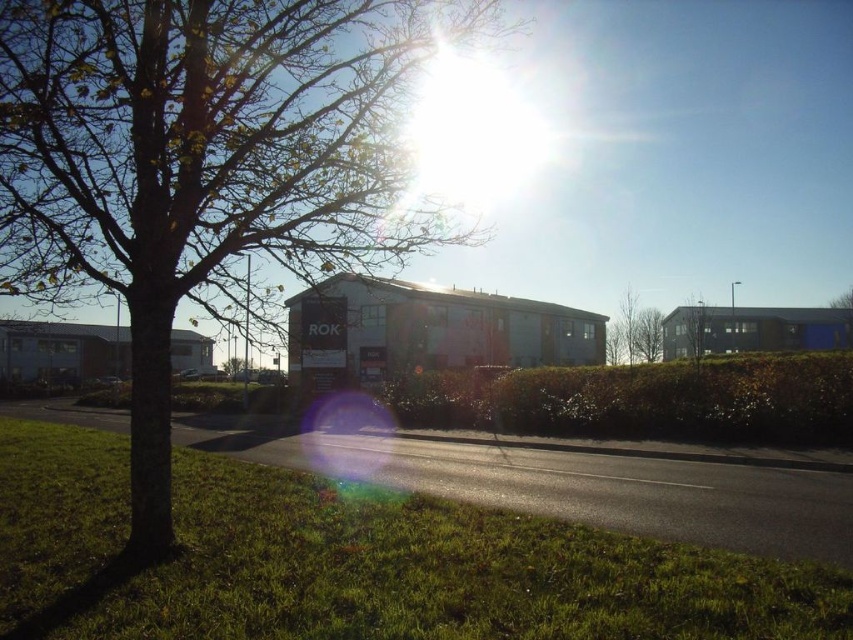
Looking at this image, you are standing on the green grass at lower left and want to see the top of the brown bark tree at center. Can you see it without moving your head?

The brown bark tree at center is taller than green grass at lower left, so yes, you can see the top of the brown bark tree at center from the green grass at lower left without moving your head.

You are standing at the point marked by the coordinates point (206, 163). Looking around, you see a brown bark tree at center. Which direction should you face to see the road running horizontally across the frame?

The brown bark tree at center is represented by point (206, 163). To see the road running horizontally across the frame, you should face towards the midground where the road is located.